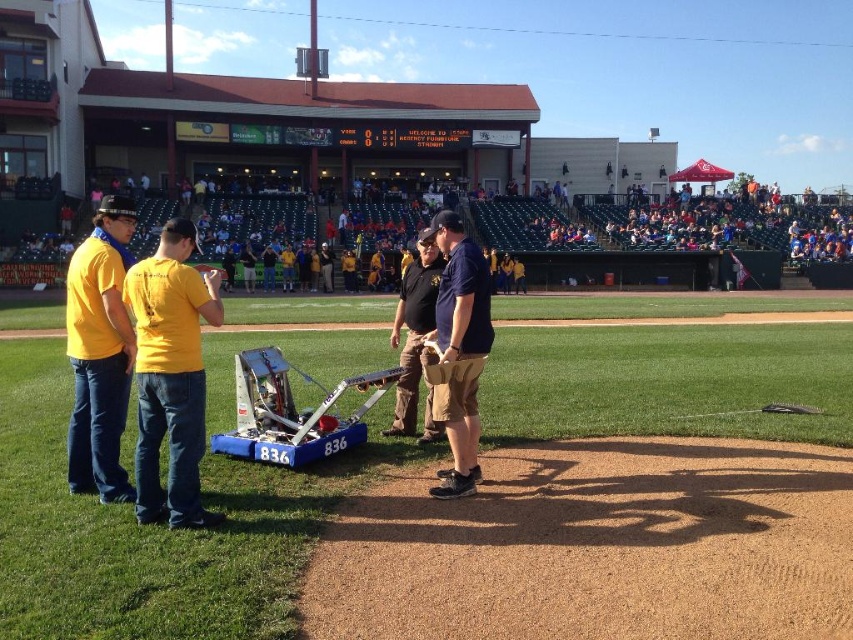
You are a photographer at the baseball stadium and want to capture both the yellow matte shirt at left and the matte yellow shirt at left in a single photo. Which of the two shirts should you focus on to ensure the smaller one is clearly visible?

The yellow matte shirt at left is smaller than the matte yellow shirt at left, so focusing on the yellow matte shirt at left will ensure the smaller one is clearly visible.

You are a photographer at the baseball stadium and want to capture both the yellow matte shirt at left and the matte yellow shirt at left in a single photo. Which one should you focus on first to ensure both are in frame?

The yellow matte shirt at left is shorter than the matte yellow shirt at left, so you should focus on the taller matte yellow shirt at left first to ensure both are in frame.

You are standing at the baseball stadium and notice two points marked in the image. The first point is at coordinates point (102, 372) and the second is at point (419, 344). From your perspective, which point is closer to you?

Point (102, 372) is in front of point (419, 344), so it is closer to you.